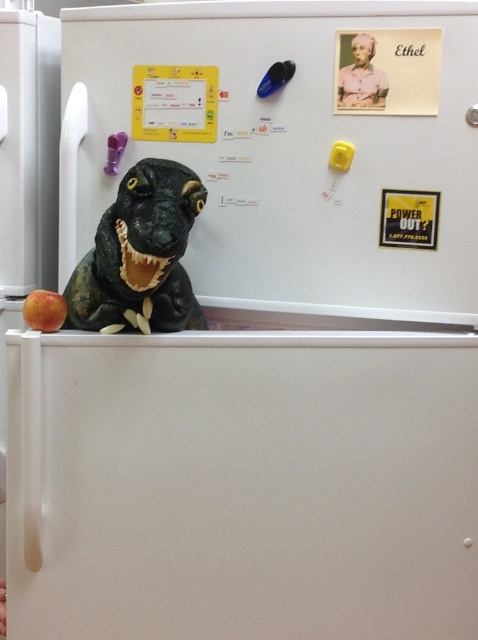
Question: Considering the relative positions of shiny plastic dinosaur at center and red matte apple at lower left in the image provided, where is shiny plastic dinosaur at center located with respect to red matte apple at lower left?

Choices:
 (A) below
 (B) above

Answer: (B)

Question: Which of the following is the closest to the observer?

Choices:
 (A) (50, 296)
 (B) (131, 218)

Answer: (B)

Question: Can you confirm if shiny plastic dinosaur at center is positioned to the right of red matte apple at lower left?

Choices:
 (A) yes
 (B) no

Answer: (A)

Question: Is shiny plastic dinosaur at center wider than red matte apple at lower left?

Choices:
 (A) yes
 (B) no

Answer: (A)

Question: Which point appears closest to the camera in this image?

Choices:
 (A) (42, 300)
 (B) (121, 257)

Answer: (B)